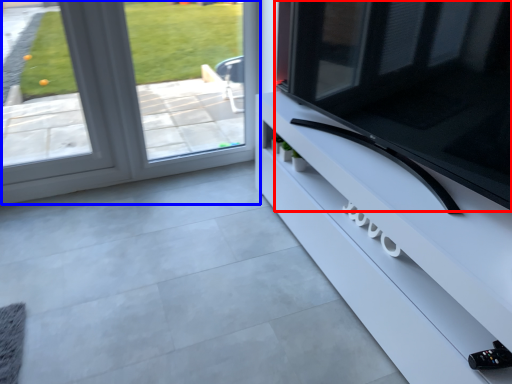
Question: Which object is further to the camera taking this photo, television (highlighted by a red box) or window (highlighted by a blue box)?

Choices:
 (A) television
 (B) window

Answer: (B)